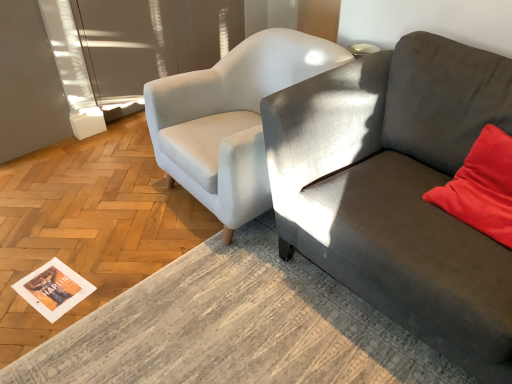
The image size is (512, 384). Find the location of `free space underneath white paper magazine at lower left (from a real-world perspective)`. free space underneath white paper magazine at lower left (from a real-world perspective) is located at coordinates (50, 284).